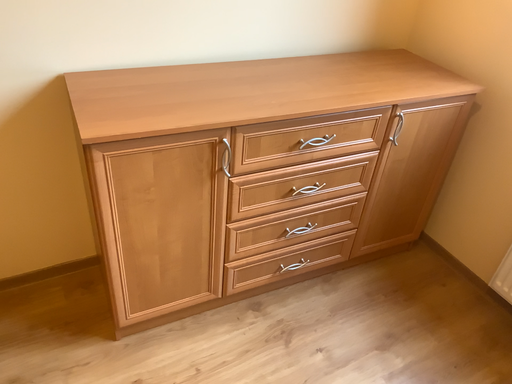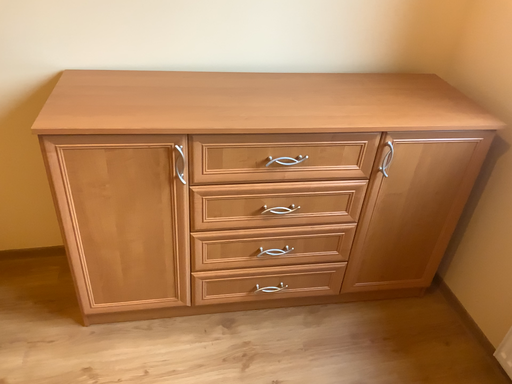
Question: How did the camera likely rotate when shooting the video?

Choices:
 (A) rotated left
 (B) rotated right

Answer: (A)